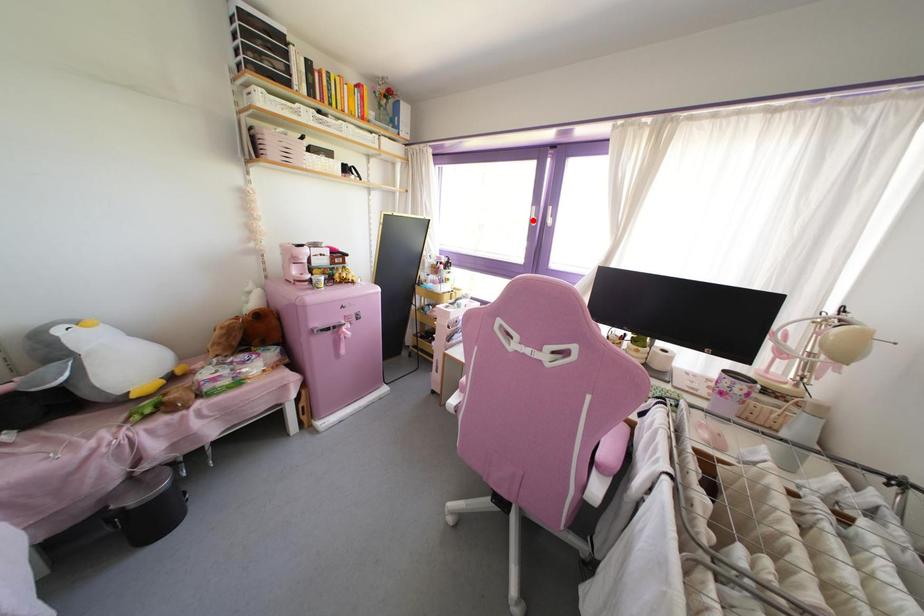
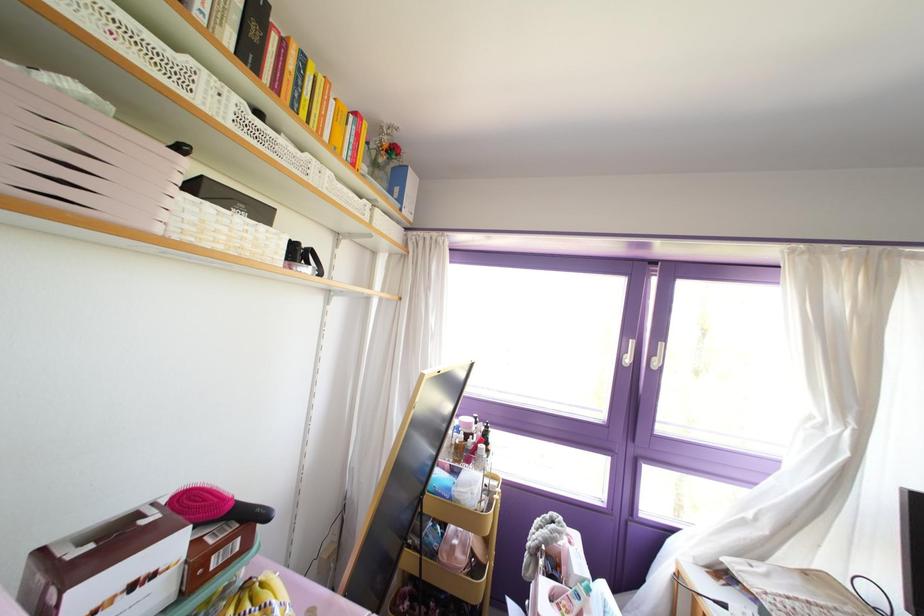
Question: I am providing you with two images of the same scene from different viewpoints. Given a red point in image1, look at the same physical point in image2. Is it:

Choices:
 (A) Closer to the viewpoint
 (B) Farther from the viewpoint

Answer: (B)